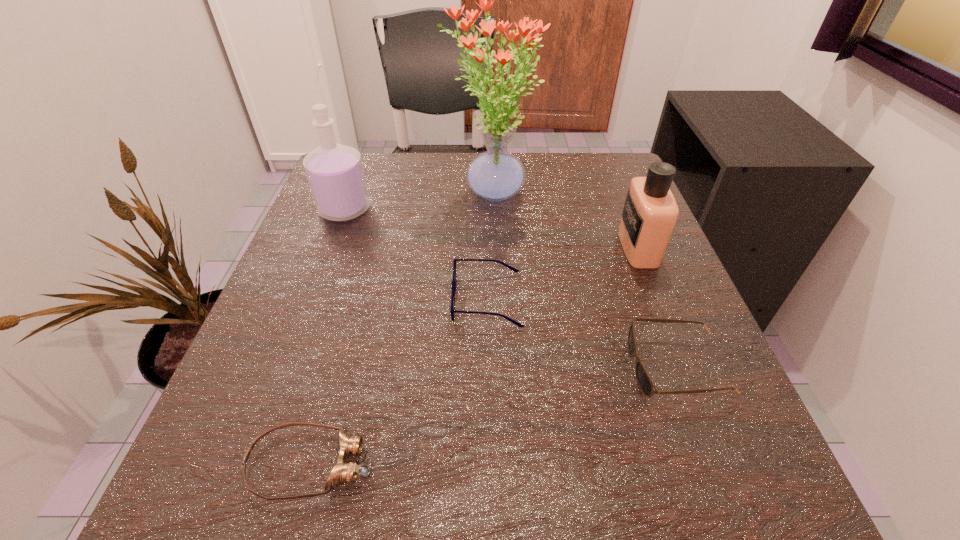
At what (x,y) coordinates should I click in order to perform the action: click on flower arrangement. Please return your answer as a coordinate pair (x, y). This screenshot has height=540, width=960. Looking at the image, I should click on (495, 175).

Identify the location of the taller perfume. (335, 173).

The width and height of the screenshot is (960, 540). In order to click on the left perfume in this screenshot , I will do `click(335, 173)`.

Identify the location of the shorter perfume. The image size is (960, 540). (650, 212).

Where is `the third tallest object`? the third tallest object is located at coordinates (650, 212).

This screenshot has height=540, width=960. Find the location of `the fourth farthest object`. the fourth farthest object is located at coordinates (452, 310).

Where is `the fifth farthest object`? This screenshot has width=960, height=540. the fifth farthest object is located at coordinates (646, 385).

Where is `the shortest object`? the shortest object is located at coordinates (342, 472).

At what (x,y) coordinates should I click in order to perform the action: click on the nearest object. Please return your answer as a coordinate pair (x, y). The image size is (960, 540). Looking at the image, I should click on (342, 472).

Locate an element on the screen. vacant region located on the back of the tallest object is located at coordinates (490, 156).